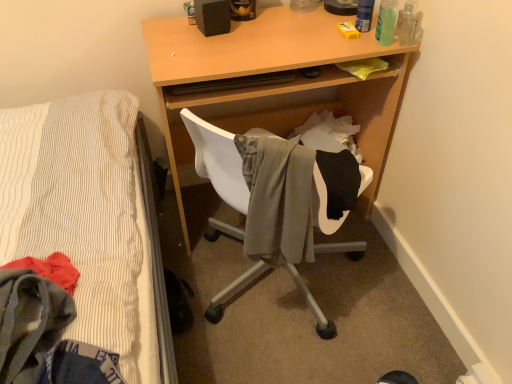
You are a GUI agent. You are given a task and a screenshot of the screen. Output one action in this format:
    pyautogui.click(x=<x>, y=<y>)
    Task: Click on the free space in front of matte black speaker at upper center
    The height and width of the screenshot is (384, 512).
    Given the screenshot: What is the action you would take?
    pyautogui.click(x=211, y=50)